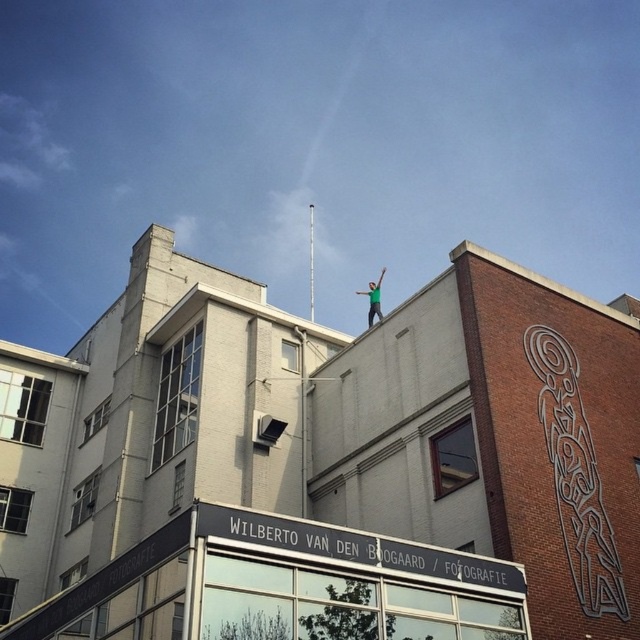
Question: Which point is closer to the camera?

Choices:
 (A) green fabric person at upper center
 (B) white glossy pole at upper center

Answer: (A)

Question: Can you confirm if white glossy pole at upper center is smaller than green fabric person at upper center?

Choices:
 (A) no
 (B) yes

Answer: (B)

Question: Can you confirm if white glossy pole at upper center is wider than green fabric person at upper center?

Choices:
 (A) yes
 (B) no

Answer: (B)

Question: Which point appears farthest from the camera in this image?

Choices:
 (A) (364, 291)
 (B) (310, 243)

Answer: (A)

Question: Where is white glossy pole at upper center located in relation to green fabric person at upper center in the image?

Choices:
 (A) right
 (B) left

Answer: (B)